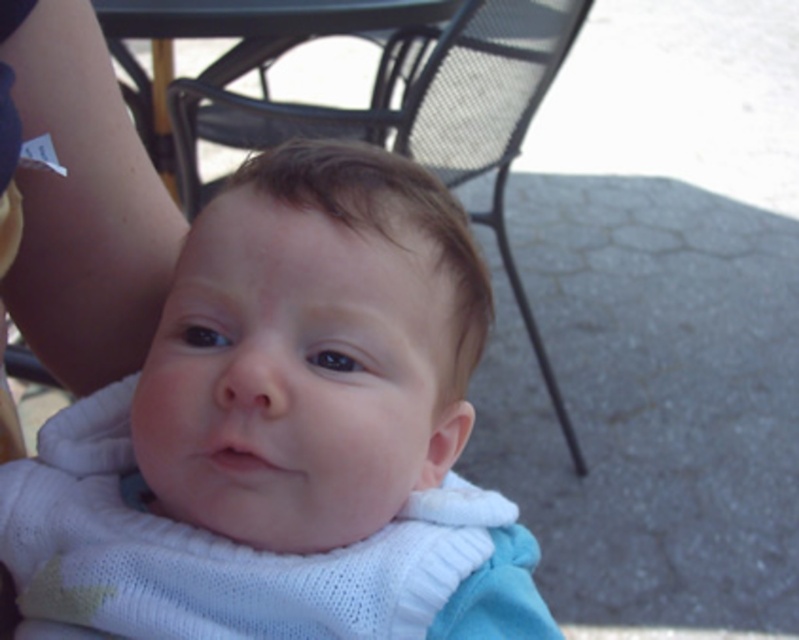
Between black mesh chair at upper center and black metal table at upper center, which one has more height?

black mesh chair at upper center

Can you confirm if black mesh chair at upper center is thinner than black metal table at upper center?

In fact, black mesh chair at upper center might be wider than black metal table at upper center.

What do you see at coordinates (412, 115) in the screenshot?
I see `black mesh chair at upper center` at bounding box center [412, 115].

Where is `black mesh chair at upper center`? The height and width of the screenshot is (640, 799). black mesh chair at upper center is located at coordinates (412, 115).

Can you confirm if skinny white arm at upper left is shorter than black mesh chair at upper center?

Indeed, skinny white arm at upper left has a lesser height compared to black mesh chair at upper center.

Who is taller, skinny white arm at upper left or black mesh chair at upper center?

black mesh chair at upper center is taller.

Locate an element on the screen. skinny white arm at upper left is located at coordinates (82, 208).

Is white knitted baby at center below skinny white arm at upper left?

Indeed, white knitted baby at center is positioned under skinny white arm at upper left.

Between white knitted baby at center and skinny white arm at upper left, which one has more height?

Standing taller between the two is skinny white arm at upper left.

Locate an element on the screen. The width and height of the screenshot is (799, 640). white knitted baby at center is located at coordinates (285, 433).